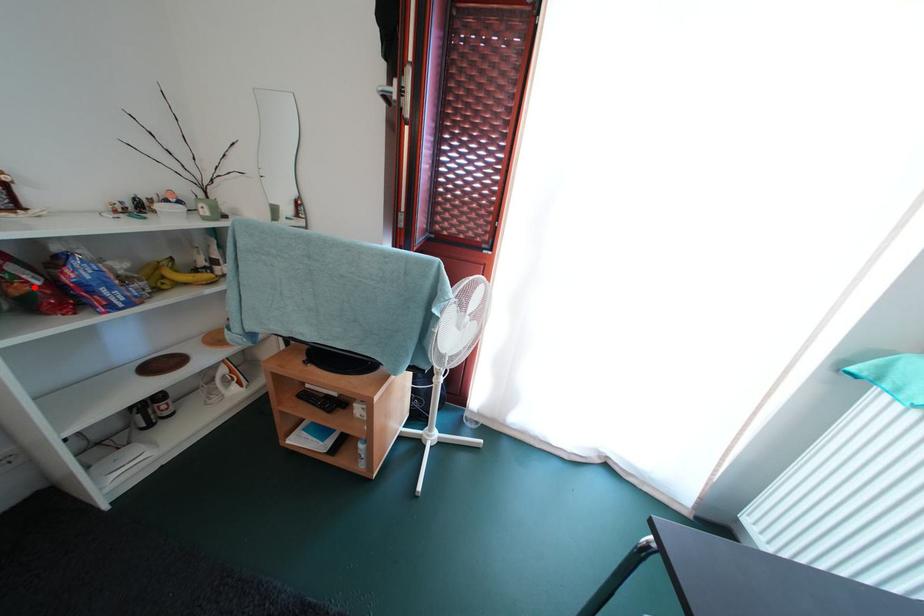
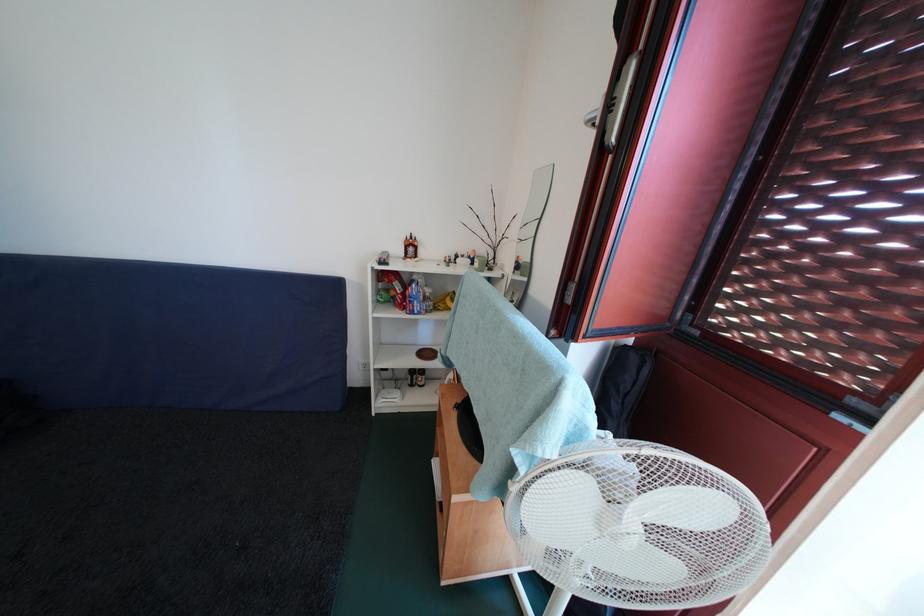
Find the pixel in the second image that matches the highlighted location in the first image.

(403, 296)